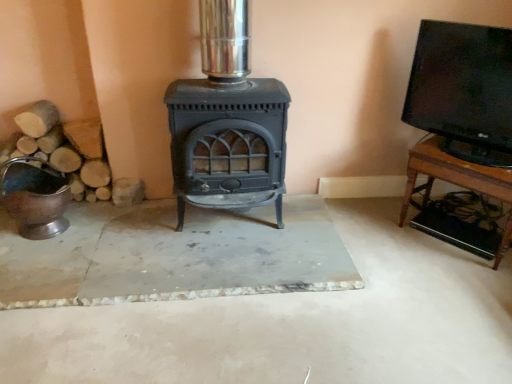
Question: Is black glossy tv at upper right directly adjacent to wooden tv stand at right?

Choices:
 (A) no
 (B) yes

Answer: (A)

Question: Can you confirm if black glossy tv at upper right is smaller than wooden tv stand at right?

Choices:
 (A) no
 (B) yes

Answer: (B)

Question: Does black glossy tv at upper right have a greater height compared to wooden tv stand at right?

Choices:
 (A) yes
 (B) no

Answer: (A)

Question: Is wooden tv stand at right completely or partially inside black glossy tv at upper right?

Choices:
 (A) no
 (B) yes

Answer: (A)

Question: Can you confirm if black glossy tv at upper right is positioned to the right of wooden tv stand at right?

Choices:
 (A) no
 (B) yes

Answer: (A)

Question: From a real-world perspective, is black glossy tv at upper right beneath wooden tv stand at right?

Choices:
 (A) no
 (B) yes

Answer: (A)

Question: Is the position of wooden tv stand at right more distant than that of matte black wood burning stove at center?

Choices:
 (A) yes
 (B) no

Answer: (A)

Question: Considering the relative sizes of wooden tv stand at right and matte black wood burning stove at center in the image provided, is wooden tv stand at right thinner than matte black wood burning stove at center?

Choices:
 (A) yes
 (B) no

Answer: (A)

Question: Is wooden tv stand at right far from matte black wood burning stove at center?

Choices:
 (A) no
 (B) yes

Answer: (A)

Question: Is wooden tv stand at right facing away from matte black wood burning stove at center?

Choices:
 (A) yes
 (B) no

Answer: (B)

Question: Can we say wooden tv stand at right lies outside matte black wood burning stove at center?

Choices:
 (A) yes
 (B) no

Answer: (A)

Question: Considering the relative sizes of wooden tv stand at right and matte black wood burning stove at center in the image provided, is wooden tv stand at right bigger than matte black wood burning stove at center?

Choices:
 (A) no
 (B) yes

Answer: (A)

Question: From the image's perspective, is black glossy tv at upper right above shiny metallic bucket at left?

Choices:
 (A) yes
 (B) no

Answer: (A)